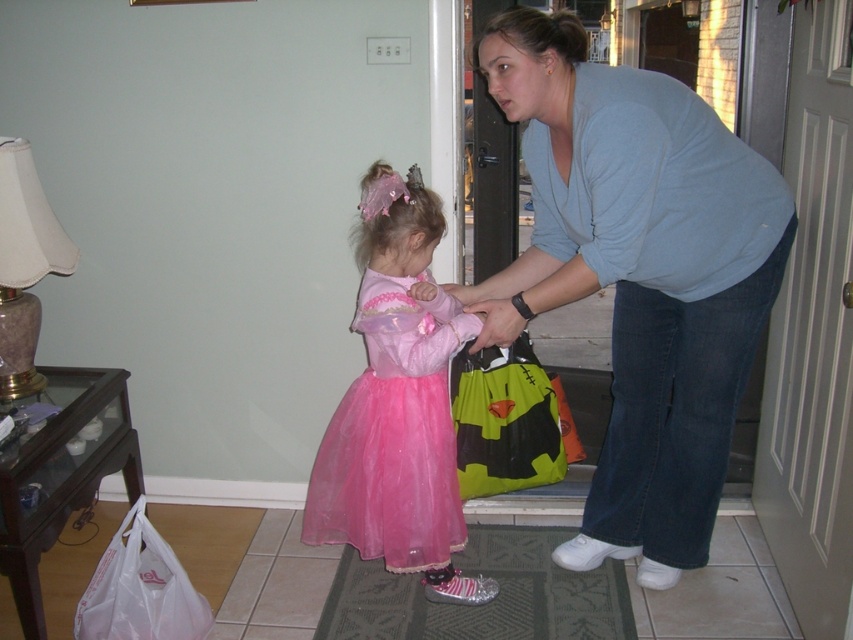
You are a fashion designer observing the domestic scene. You need to determine which item is larger in size between the light blue shirt at upper right and the green textured mat at lower center. Can you identify the larger one?

The light blue shirt at upper right is bigger than the green textured mat at lower center, so the light blue shirt at upper right is the larger item between them.

You are standing at the entrance of the house and see the green textured mat at lower center and the transparent plastic bag at lower left. Which object is closer to you?

The green textured mat at lower center is closer to you because the transparent plastic bag at lower left is behind it.

You are a delivery person who needs to place a package on the floor. The package is as wide as the green fabric bag at center. Can you place it on the green textured mat at lower center without it hanging off the edge?

The green textured mat at lower center is wider than the green fabric bag at center, so yes, the package can be placed on the green textured mat at lower center without hanging off the edge since the mat is wider than the bag.